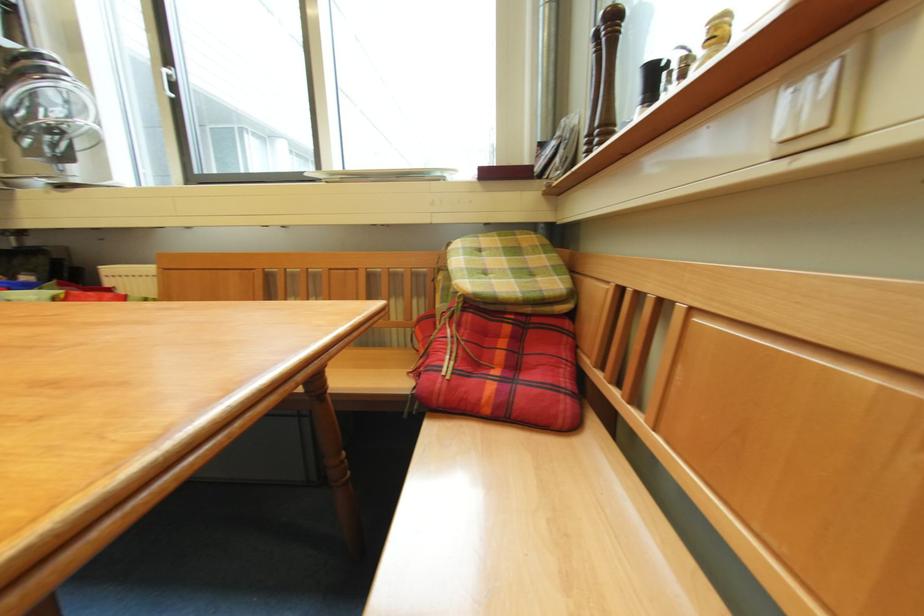
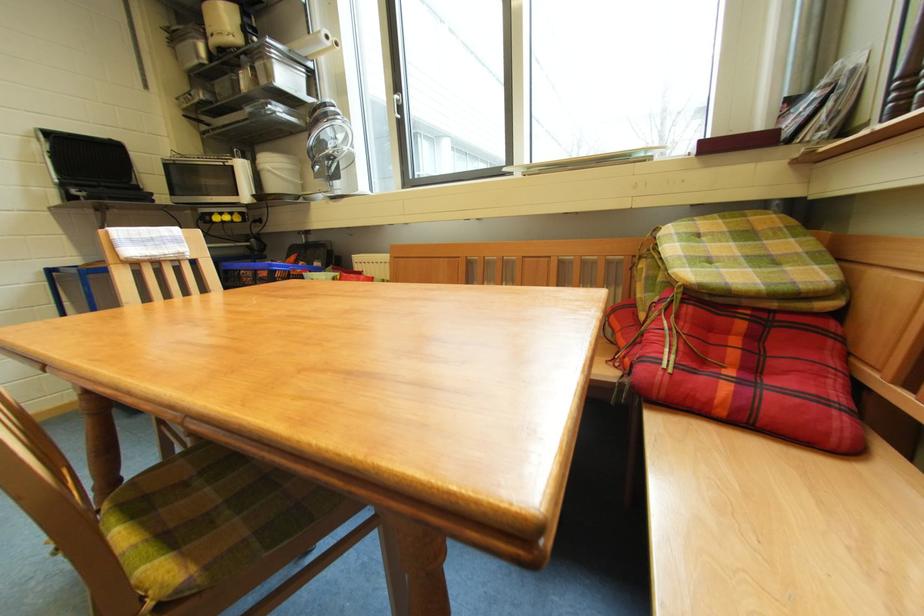
Question: The images are taken continuously from a first-person perspective. In which direction is your viewpoint rotating?

Choices:
 (A) Left
 (B) Right
 (C) Up
 (D) Down

Answer: (A)